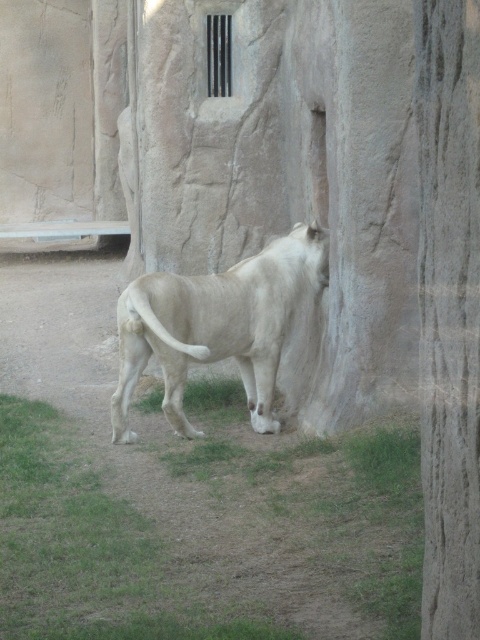
Question: Considering the relative positions of green grass at lower center and white fur lion at center in the image provided, where is green grass at lower center located with respect to white fur lion at center?

Choices:
 (A) below
 (B) above

Answer: (A)

Question: Which object appears farthest from the camera in this image?

Choices:
 (A) white fur lion at center
 (B) green grass at lower center

Answer: (A)

Question: Does green grass at lower center appear under white fur lion at center?

Choices:
 (A) no
 (B) yes

Answer: (B)

Question: Is green grass at lower center to the left of white fur lion at center from the viewer's perspective?

Choices:
 (A) no
 (B) yes

Answer: (B)

Question: Which point appears farthest from the camera in this image?

Choices:
 (A) (35, 632)
 (B) (273, 317)

Answer: (B)